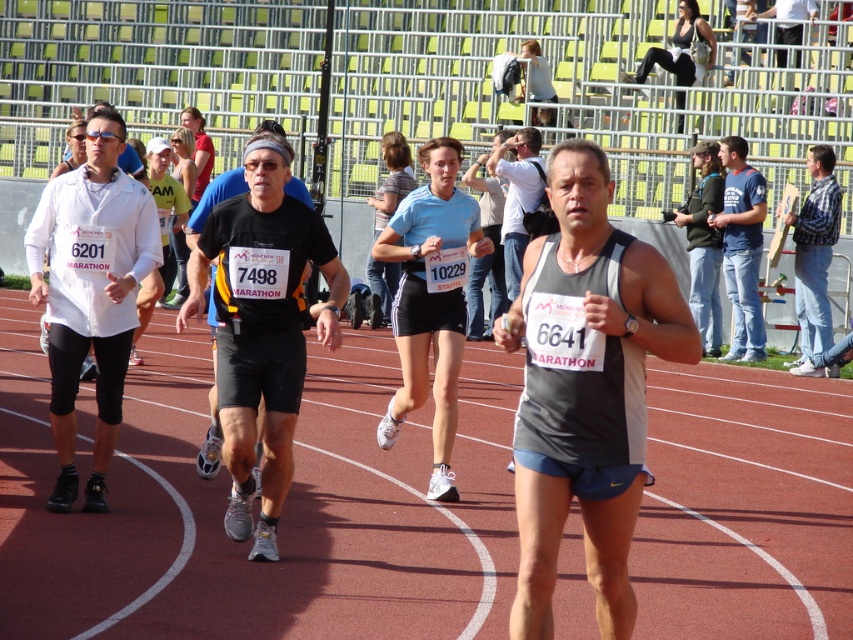
Question: Is white matte shirt at left wider than gray fabric shirt at center?

Choices:
 (A) no
 (B) yes

Answer: (B)

Question: Is red rubber track at center positioned in front of gray fabric shirt at center?

Choices:
 (A) no
 (B) yes

Answer: (B)

Question: Does light blue fabric shorts at center appear under gray tank top at center?

Choices:
 (A) no
 (B) yes

Answer: (B)

Question: Among these objects, which one is farthest from the camera?

Choices:
 (A) light blue fabric shorts at center
 (B) blue jeans at right
 (C) red rubber track at center
 (D) gray fabric shirt at center

Answer: (D)

Question: Which of the following is the closest to the observer?

Choices:
 (A) gray fabric tank top at center
 (B) gray fabric shirt at center

Answer: (A)

Question: Which of the following is the closest to the observer?

Choices:
 (A) (242, 177)
 (B) (457, 244)
 (C) (813, 372)

Answer: (A)